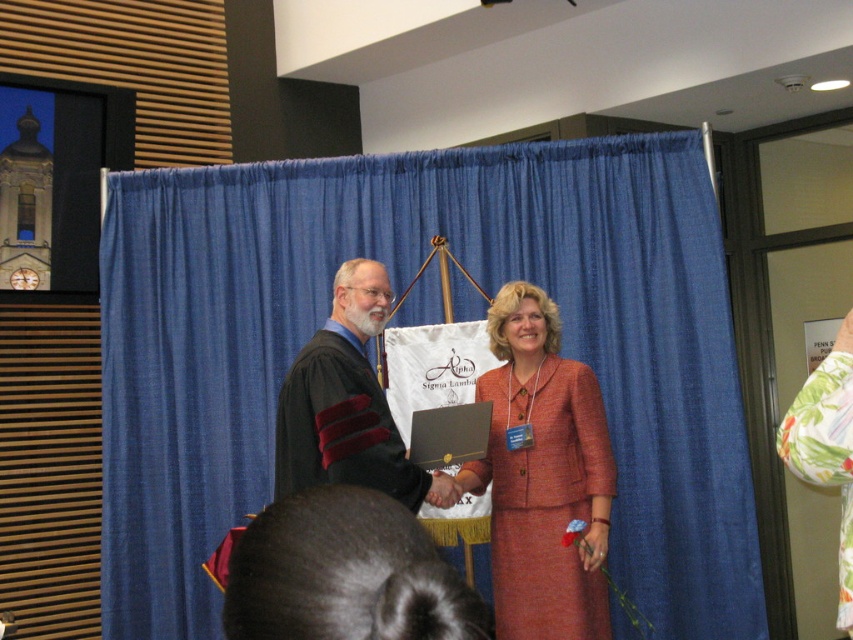
Is blue fabric curtain at center positioned behind orange woolen suit at center?

Yes, blue fabric curtain at center is further from the viewer.

Who is positioned more to the right, blue fabric curtain at center or orange woolen suit at center?

From the viewer's perspective, orange woolen suit at center appears more on the right side.

Is point (325, 166) positioned in front of point (606, 637)?

No, it is behind (606, 637).

Locate an element on the screen. The height and width of the screenshot is (640, 853). blue fabric curtain at center is located at coordinates (397, 292).

Is blue fabric curtain at center positioned before matte black robe at center?

That is False.

Is blue fabric curtain at center smaller than matte black robe at center?

Actually, blue fabric curtain at center might be larger than matte black robe at center.

The height and width of the screenshot is (640, 853). I want to click on blue fabric curtain at center, so click(397, 292).

Does orange woolen suit at center have a greater height compared to matte black robe at center?

Indeed, orange woolen suit at center has a greater height compared to matte black robe at center.

Is orange woolen suit at center shorter than matte black robe at center?

Incorrect, orange woolen suit at center's height does not fall short of matte black robe at center's.

Does point (517, 364) come in front of point (387, 285)?

No.

At what (x,y) coordinates should I click in order to perform the action: click on orange woolen suit at center. Please return your answer as a coordinate pair (x, y). Looking at the image, I should click on (541, 476).